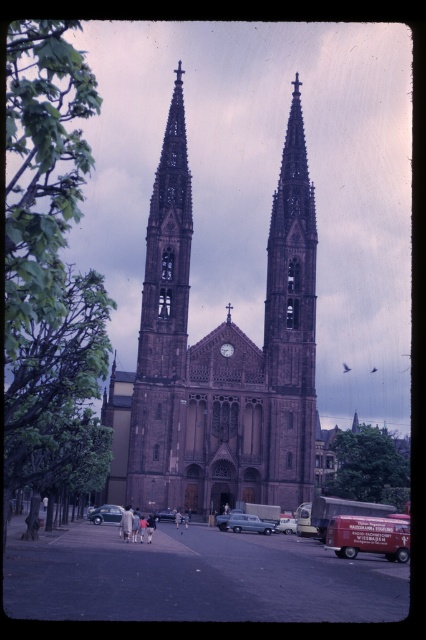
Does metallic silver car at lower left appear on the right side of shiny silver sedan at center?

No, metallic silver car at lower left is not to the right of shiny silver sedan at center.

Between metallic silver car at lower left and shiny silver sedan at center, which one appears on the right side from the viewer's perspective?

Positioned to the right is shiny silver sedan at center.

Between point (95, 508) and point (157, 513), which one is positioned behind?

Point (95, 508)

Image resolution: width=426 pixels, height=640 pixels. Identify the location of metallic silver car at lower left. (106, 515).

Between point (218, 380) and point (284, 529), which one is positioned behind?

Point (284, 529)

What do you see at coordinates (218, 356) in the screenshot? I see `brown stone church at center` at bounding box center [218, 356].

Who is more forward, (275, 291) or (284, 522)?

Point (284, 522) is in front.

Where is `brown stone church at center`? The image size is (426, 640). brown stone church at center is located at coordinates coord(218,356).

Can you confirm if light blue metallic car at center is smaller than metallic silver van at center?

No.

Does point (261, 531) come farther from viewer compared to point (288, 529)?

No, (261, 531) is closer to viewer.

Locate an element on the screen. This screenshot has height=640, width=426. light blue metallic car at center is located at coordinates (249, 524).